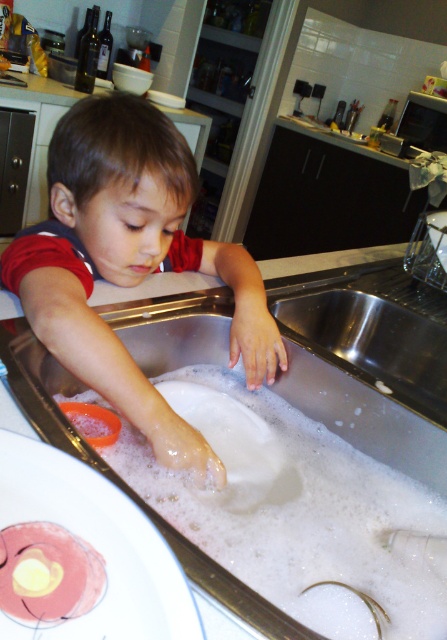
Question: Which point appears farthest from the camera in this image?

Choices:
 (A) (223, 472)
 (B) (261, 372)
 (C) (226, 588)
 (D) (118, 125)

Answer: (B)

Question: Is smooth plastic bowl at center wider than white matte hand at lower center?

Choices:
 (A) no
 (B) yes

Answer: (B)

Question: Is smooth plastic bowl at center wider than white matte hand at lower center?

Choices:
 (A) no
 (B) yes

Answer: (B)

Question: Which point is closer to the camera?

Choices:
 (A) (283, 355)
 (B) (130, 186)
 (C) (223, 474)

Answer: (C)

Question: Which point appears closest to the camera in this image?

Choices:
 (A) tap(392, 348)
 (B) tap(257, 308)
 (C) tap(87, 355)

Answer: (C)

Question: Is stainless steel sink at lower center wider than smooth plastic bowl at center?

Choices:
 (A) no
 (B) yes

Answer: (B)